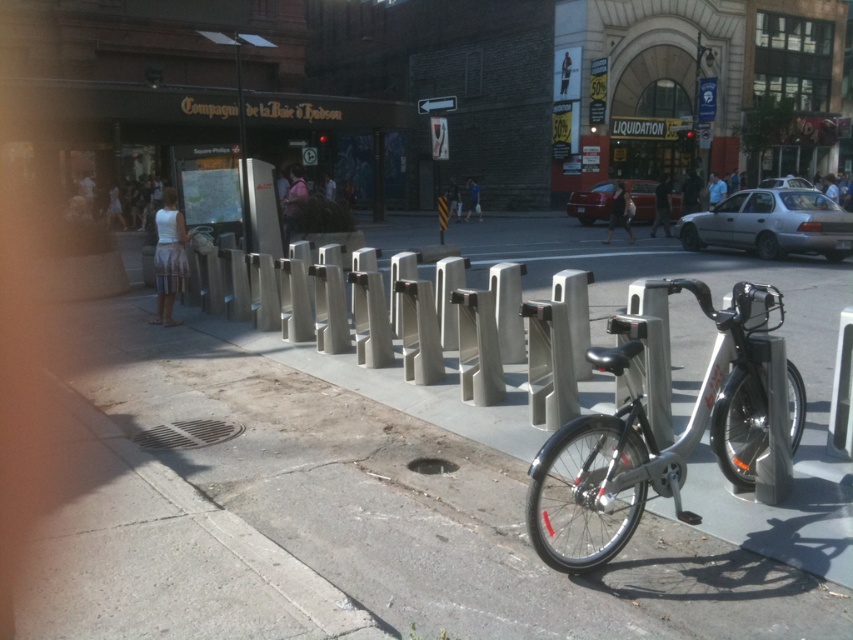
Is gray concrete sidewalk at center wider than silver metallic bicycle at center?

In fact, gray concrete sidewalk at center might be narrower than silver metallic bicycle at center.

Can you confirm if gray concrete sidewalk at center is thinner than silver metallic bicycle at center?

Yes, gray concrete sidewalk at center is thinner than silver metallic bicycle at center.

Between point (183, 380) and point (560, 458), which one is positioned in front?

Positioned in front is point (560, 458).

Where is `gray concrete sidewalk at center`? The image size is (853, 640). gray concrete sidewalk at center is located at coordinates (343, 515).